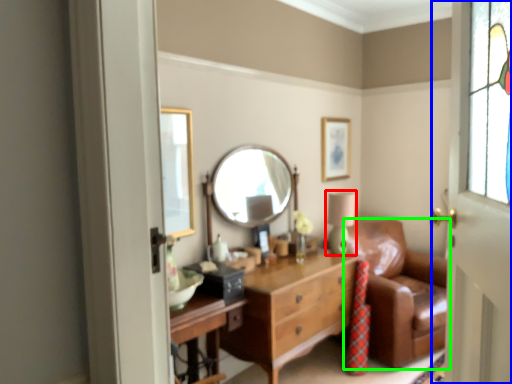
Question: Which object is positioned closest to table lamp (highlighted by a red box)? Select from door (highlighted by a blue box) and studio couch (highlighted by a green box).

Choices:
 (A) door
 (B) studio couch

Answer: (B)